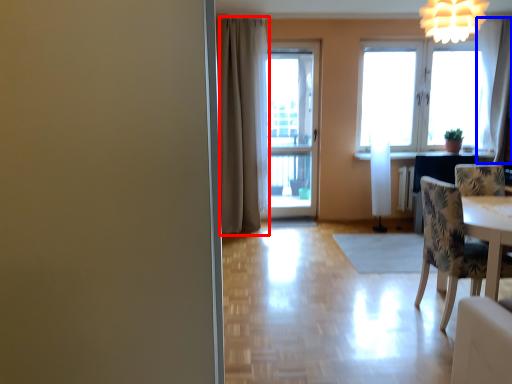
Question: Which object is further to the camera taking this photo, curtain (highlighted by a red box) or curtain (highlighted by a blue box)?

Choices:
 (A) curtain
 (B) curtain

Answer: (B)